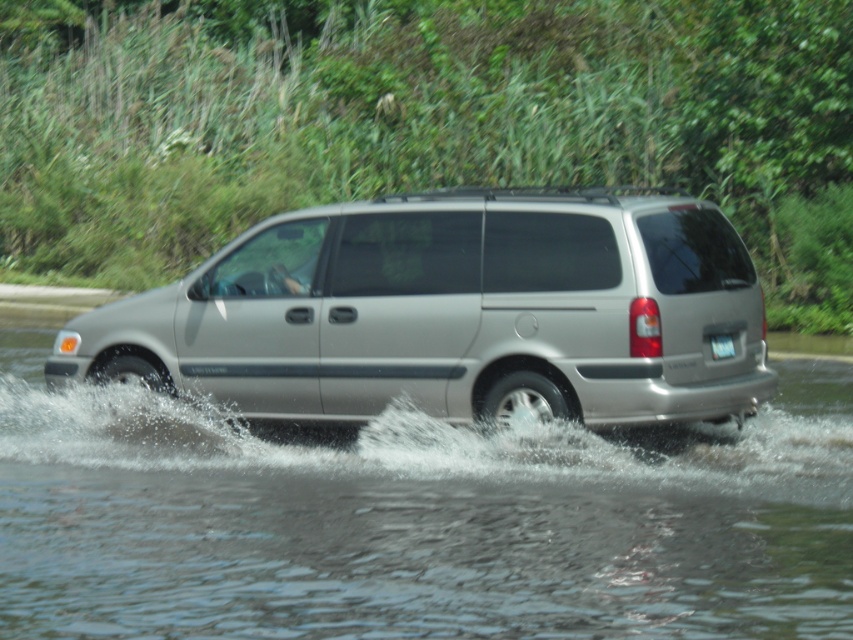
Question: Does clear water at lower center appear on the right side of satin silver van at center?

Choices:
 (A) no
 (B) yes

Answer: (B)

Question: Estimate the real-world distances between objects in this image. Which object is closer to the white plastic license plate at rear?

Choices:
 (A) satin silver van at center
 (B) clear water at lower center

Answer: (A)

Question: Does clear water at lower center have a smaller size compared to white plastic license plate at rear?

Choices:
 (A) yes
 (B) no

Answer: (B)

Question: Which of the following is the farthest from the observer?

Choices:
 (A) (70, 556)
 (B) (190, 394)

Answer: (B)

Question: Estimate the real-world distances between objects in this image. Which object is farther from the satin silver van at center?

Choices:
 (A) clear water at lower center
 (B) white plastic license plate at rear

Answer: (B)

Question: Is clear water at lower center to the right of satin silver van at center from the viewer's perspective?

Choices:
 (A) yes
 (B) no

Answer: (A)